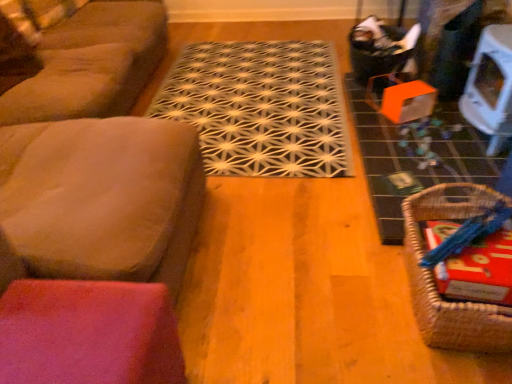
Find the location of a particular element. Image resolution: width=512 pixels, height=384 pixels. free region on the left part of woven brown basket at lower right is located at coordinates (341, 294).